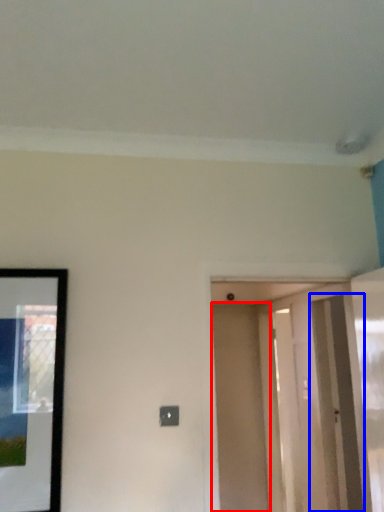
Question: Which object appears farthest to the camera in this image, door (highlighted by a red box) or screen door (highlighted by a blue box)?

Choices:
 (A) door
 (B) screen door

Answer: (A)